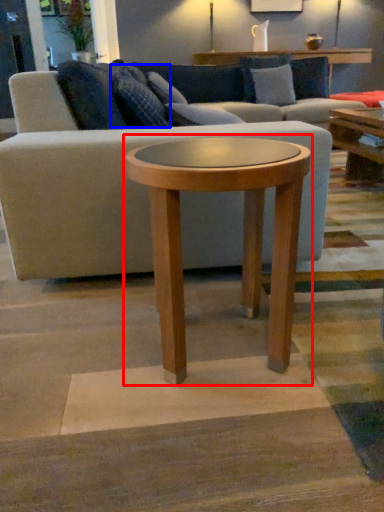
Question: Among these objects, which one is farthest to the camera, coffee table (highlighted by a red box) or pillow (highlighted by a blue box)?

Choices:
 (A) coffee table
 (B) pillow

Answer: (B)